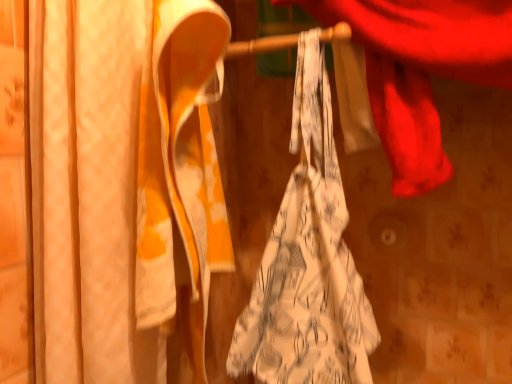
Question: Is white printed fabric at center facing towards matte white curtain at left?

Choices:
 (A) no
 (B) yes

Answer: (A)

Question: From the image's perspective, is white printed fabric at center under matte white curtain at left?

Choices:
 (A) yes
 (B) no

Answer: (A)

Question: Does white printed fabric at center have a smaller size compared to matte white curtain at left?

Choices:
 (A) no
 (B) yes

Answer: (A)

Question: Would you say white printed fabric at center contains matte white curtain at left?

Choices:
 (A) yes
 (B) no

Answer: (B)

Question: Considering the relative sizes of white printed fabric at center and matte white curtain at left in the image provided, is white printed fabric at center thinner than matte white curtain at left?

Choices:
 (A) no
 (B) yes

Answer: (B)

Question: Is white printed fabric at center outside matte white curtain at left?

Choices:
 (A) yes
 (B) no

Answer: (A)

Question: Is white printed fabric at center surrounded by matte white curtain at left?

Choices:
 (A) yes
 (B) no

Answer: (B)

Question: Can you confirm if matte white curtain at left is smaller than white printed fabric at center?

Choices:
 (A) no
 (B) yes

Answer: (B)

Question: Does matte white curtain at left have a lesser width compared to white printed fabric at center?

Choices:
 (A) no
 (B) yes

Answer: (A)

Question: Is the position of matte white curtain at left less distant than that of white printed fabric at center?

Choices:
 (A) yes
 (B) no

Answer: (A)

Question: Could you tell me if matte white curtain at left is turned towards white printed fabric at center?

Choices:
 (A) yes
 (B) no

Answer: (B)

Question: From a real-world perspective, is matte white curtain at left under white printed fabric at center?

Choices:
 (A) no
 (B) yes

Answer: (A)

Question: In the image, is white printed fabric at center positioned in front of or behind matte white curtain at left?

Choices:
 (A) front
 (B) behind

Answer: (B)